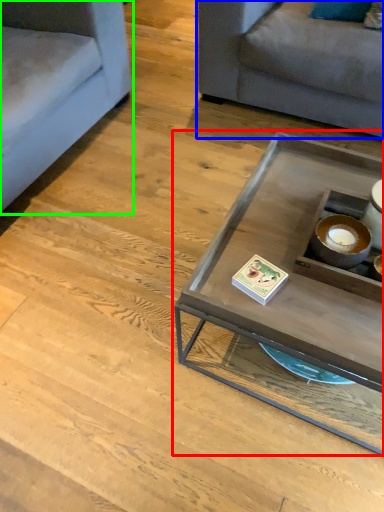
Question: Estimate the real-world distances between objects in this image. Which object is closer to coffee table (highlighted by a red box), studio couch (highlighted by a blue box) or studio couch (highlighted by a green box)?

Choices:
 (A) studio couch
 (B) studio couch

Answer: (A)